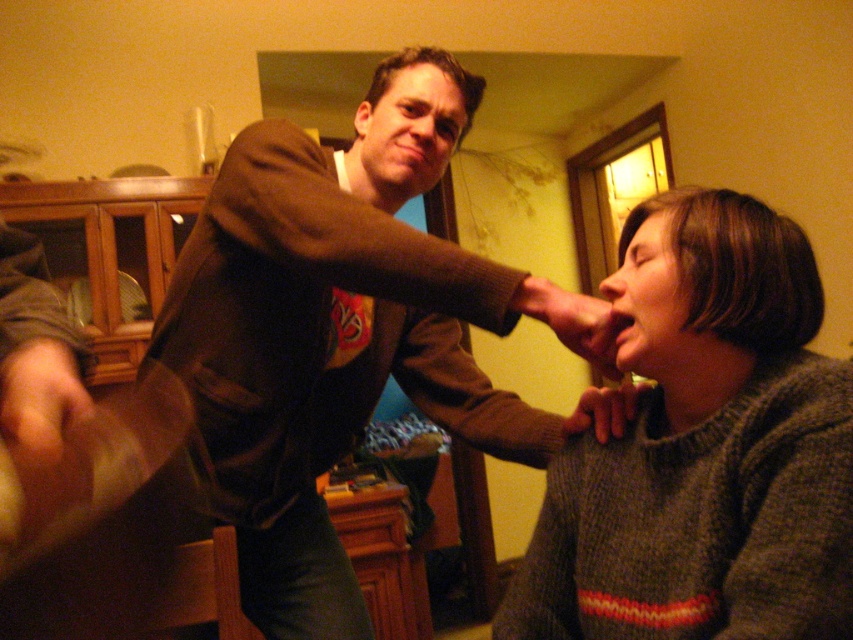
Question: Which point appears closest to the camera in this image?

Choices:
 (A) (577, 355)
 (B) (601, 406)

Answer: (A)

Question: Is brown textured sweater at upper center wider than matte brown hand at lower right?

Choices:
 (A) yes
 (B) no

Answer: (A)

Question: Which object is the closest to the matte brown hand at upper center?

Choices:
 (A) matte brown hand at lower left
 (B) brown textured sweater at upper center
 (C) knitted gray sweater at lower right
 (D) matte brown hand at lower right

Answer: (D)

Question: Can you confirm if brown textured sweater at upper center is smaller than knitted gray sweater at lower right?

Choices:
 (A) no
 (B) yes

Answer: (A)

Question: Which of the following is the closest to the observer?

Choices:
 (A) matte brown hand at lower left
 (B) brown textured sweater at upper center

Answer: (A)

Question: From the image, what is the correct spatial relationship of knitted gray sweater at lower right in relation to matte brown hand at upper center?

Choices:
 (A) right
 (B) left

Answer: (A)